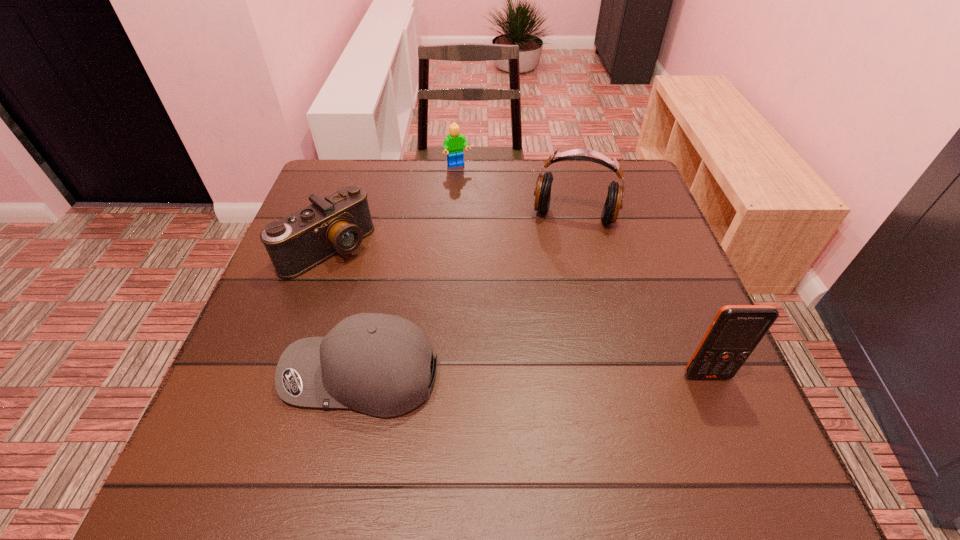
The height and width of the screenshot is (540, 960). Identify the location of vacant space in between the rightmost object and the baseball cap. (534, 375).

Locate an element on the screen. The image size is (960, 540). vacant point located between the baseball cap and the Lego is located at coordinates (409, 271).

Identify the location of object that is the second closest to the camera. (454, 143).

Identify the location of object identified as the second closest to the farthest object. (338, 223).

Identify the location of vacant region that satisfies the following two spatial constraints: 1. on the front side of the second object from right to left; 2. on the right side of the Lego. The height and width of the screenshot is (540, 960). (454, 216).

Where is `free space that satisfies the following two spatial constraints: 1. on the front side of the camera; 2. on the front brim of the baseball cap`? free space that satisfies the following two spatial constraints: 1. on the front side of the camera; 2. on the front brim of the baseball cap is located at coordinates (282, 375).